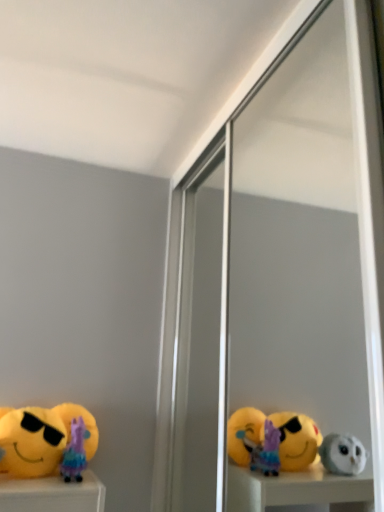
Find the location of a particular element. The height and width of the screenshot is (512, 384). yellow plush toy at lower left, which ranks as the 1th toy in left-to-right order is located at coordinates (42, 438).

Where is `transparent glass screen door at center`? transparent glass screen door at center is located at coordinates (280, 280).

You are a GUI agent. You are given a task and a screenshot of the screen. Output one action in this format:
    pyautogui.click(x=<x>, y=<y>)
    Task: Click on the yellow plush toy at lower left, acting as the second toy starting from the right
    The image size is (384, 512).
    Given the screenshot: What is the action you would take?
    point(42,438)

From the image's perspective, is purple fabric doll at lower left, which is counted as the 1th toy, starting from the right, located beneath yellow plush toy at lower left, which ranks as the 1th toy in left-to-right order?

Indeed, from the image's perspective, purple fabric doll at lower left, which is counted as the 1th toy, starting from the right, is shown beneath yellow plush toy at lower left, which ranks as the 1th toy in left-to-right order.

Considering the points (84, 467) and (22, 440), which point is behind, point (84, 467) or point (22, 440)?

The point (84, 467) is farther.

Between purple fabric doll at lower left, positioned as the second toy in left-to-right order, and yellow plush toy at lower left, which ranks as the 1th toy in left-to-right order, which one has smaller width?

yellow plush toy at lower left, which ranks as the 1th toy in left-to-right order.

Is purple fabric doll at lower left, positioned as the second toy in left-to-right order, taller than yellow plush toy at lower left, acting as the second toy starting from the right?

Incorrect, the height of purple fabric doll at lower left, positioned as the second toy in left-to-right order, is not larger of that of yellow plush toy at lower left, acting as the second toy starting from the right.

Considering the sizes of objects transparent glass screen door at center and purple fabric doll at lower left, positioned as the second toy in left-to-right order, in the image provided, who is shorter, transparent glass screen door at center or purple fabric doll at lower left, positioned as the second toy in left-to-right order,?

purple fabric doll at lower left, positioned as the second toy in left-to-right order.

Considering the sizes of objects transparent glass screen door at center and purple fabric doll at lower left, which is counted as the 1th toy, starting from the right, in the image provided, who is bigger, transparent glass screen door at center or purple fabric doll at lower left, which is counted as the 1th toy, starting from the right,?

transparent glass screen door at center is bigger.

What's the angular difference between transparent glass screen door at center and purple fabric doll at lower left, positioned as the second toy in left-to-right order,'s facing directions?

89.5 degrees separate the facing orientations of transparent glass screen door at center and purple fabric doll at lower left, positioned as the second toy in left-to-right order.

Is transparent glass screen door at center at the right side of purple fabric doll at lower left, positioned as the second toy in left-to-right order?

Yes, transparent glass screen door at center is to the right of purple fabric doll at lower left, positioned as the second toy in left-to-right order.

Could you measure the distance between yellow plush toy at lower left, acting as the second toy starting from the right, and transparent glass screen door at center?

A distance of 31.58 inches exists between yellow plush toy at lower left, acting as the second toy starting from the right, and transparent glass screen door at center.

Is yellow plush toy at lower left, which ranks as the 1th toy in left-to-right order, turned away from transparent glass screen door at center?

No, transparent glass screen door at center is not at the back of yellow plush toy at lower left, which ranks as the 1th toy in left-to-right order.

Where is `toy that is the 1st object directly below the transparent glass screen door at center (from a real-world perspective)`? toy that is the 1st object directly below the transparent glass screen door at center (from a real-world perspective) is located at coordinates (42, 438).

From a real-world perspective, is yellow plush toy at lower left, acting as the second toy starting from the right, located higher than transparent glass screen door at center?

No, from a real-world perspective, yellow plush toy at lower left, acting as the second toy starting from the right, is not on top of transparent glass screen door at center.

Considering the relative sizes of purple fabric doll at lower left, positioned as the second toy in left-to-right order, and transparent glass screen door at center in the image provided, is purple fabric doll at lower left, positioned as the second toy in left-to-right order, bigger than transparent glass screen door at center?

Incorrect, purple fabric doll at lower left, positioned as the second toy in left-to-right order, is not larger than transparent glass screen door at center.

Is purple fabric doll at lower left, positioned as the second toy in left-to-right order, not inside transparent glass screen door at center?

Yes, purple fabric doll at lower left, positioned as the second toy in left-to-right order, is located beyond the bounds of transparent glass screen door at center.

At what (x,y) coordinates should I click in order to perform the action: click on screen door on the right side of purple fabric doll at lower left, positioned as the second toy in left-to-right order. Please return your answer as a coordinate pair (x, y). Looking at the image, I should click on (280, 280).

Is purple fabric doll at lower left, which is counted as the 1th toy, starting from the right, turned away from transparent glass screen door at center?

purple fabric doll at lower left, which is counted as the 1th toy, starting from the right, does not have its back to transparent glass screen door at center.

Is yellow plush toy at lower left, acting as the second toy starting from the right, wider or thinner than purple fabric doll at lower left, positioned as the second toy in left-to-right order?

In the image, yellow plush toy at lower left, acting as the second toy starting from the right, appears to be more narrow than purple fabric doll at lower left, positioned as the second toy in left-to-right order.

Considering the points (41, 442) and (88, 447), which point is in front, point (41, 442) or point (88, 447)?

The point (41, 442) is closer to the camera.

Which of these two, yellow plush toy at lower left, which ranks as the 1th toy in left-to-right order, or purple fabric doll at lower left, which is counted as the 1th toy, starting from the right, is smaller?

With smaller size is purple fabric doll at lower left, which is counted as the 1th toy, starting from the right.

From the transparent glass screen door at center, count the 2nd toy to the left and point to it. Please provide its 2D coordinates.

[(42, 438)]

Is transparent glass screen door at center turned away from yellow plush toy at lower left, acting as the second toy starting from the right?

That's not correct — transparent glass screen door at center is not looking away from yellow plush toy at lower left, acting as the second toy starting from the right.

Considering the points (232, 177) and (36, 439), which point is behind, point (232, 177) or point (36, 439)?

Positioned behind is point (232, 177).

Is transparent glass screen door at center touching yellow plush toy at lower left, which ranks as the 1th toy in left-to-right order?

transparent glass screen door at center and yellow plush toy at lower left, which ranks as the 1th toy in left-to-right order, are not in contact.

Where is `toy to the left of purple fabric doll at lower left, positioned as the second toy in left-to-right order`? The width and height of the screenshot is (384, 512). toy to the left of purple fabric doll at lower left, positioned as the second toy in left-to-right order is located at coordinates (42, 438).

From the image's perspective, starting from the transparent glass screen door at center, which toy is the 2nd one below? Please provide its 2D coordinates.

[(77, 439)]

Which object lies further to the anchor point transparent glass screen door at center, yellow plush toy at lower left, which ranks as the 1th toy in left-to-right order, or purple fabric doll at lower left, which is counted as the 1th toy, starting from the right?

purple fabric doll at lower left, which is counted as the 1th toy, starting from the right, is further to transparent glass screen door at center.

Which object lies nearer to the anchor point transparent glass screen door at center, purple fabric doll at lower left, which is counted as the 1th toy, starting from the right, or yellow plush toy at lower left, acting as the second toy starting from the right?

yellow plush toy at lower left, acting as the second toy starting from the right, lies closer to transparent glass screen door at center than the other object.

From the image, which object appears to be nearer to yellow plush toy at lower left, which ranks as the 1th toy in left-to-right order, transparent glass screen door at center or purple fabric doll at lower left, positioned as the second toy in left-to-right order?

Based on the image, purple fabric doll at lower left, positioned as the second toy in left-to-right order, appears to be nearer to yellow plush toy at lower left, which ranks as the 1th toy in left-to-right order.

From the image, which object appears to be nearer to yellow plush toy at lower left, acting as the second toy starting from the right, purple fabric doll at lower left, which is counted as the 1th toy, starting from the right, or transparent glass screen door at center?

purple fabric doll at lower left, which is counted as the 1th toy, starting from the right, is closer to yellow plush toy at lower left, acting as the second toy starting from the right.

Looking at the image, which one is located further to purple fabric doll at lower left, which is counted as the 1th toy, starting from the right, transparent glass screen door at center or yellow plush toy at lower left, which ranks as the 1th toy in left-to-right order?

Among the two, transparent glass screen door at center is located further to purple fabric doll at lower left, which is counted as the 1th toy, starting from the right.

Which object lies nearer to the anchor point purple fabric doll at lower left, positioned as the second toy in left-to-right order, yellow plush toy at lower left, which ranks as the 1th toy in left-to-right order, or transparent glass screen door at center?

Among the two, yellow plush toy at lower left, which ranks as the 1th toy in left-to-right order, is located nearer to purple fabric doll at lower left, positioned as the second toy in left-to-right order.

Identify the location of toy positioned between transparent glass screen door at center and purple fabric doll at lower left, positioned as the second toy in left-to-right order, from near to far. The image size is (384, 512). (42, 438).